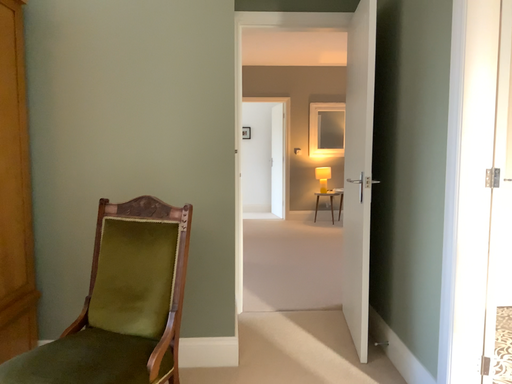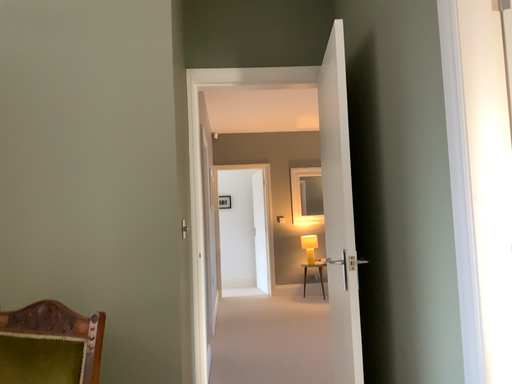
Question: How did the camera likely rotate when shooting the video?

Choices:
 (A) rotated downward
 (B) rotated upward

Answer: (B)